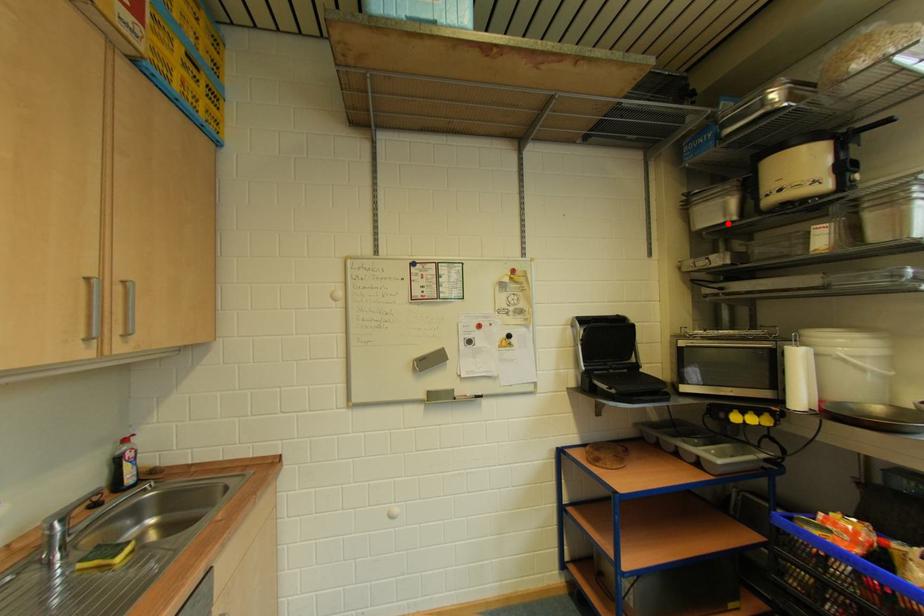
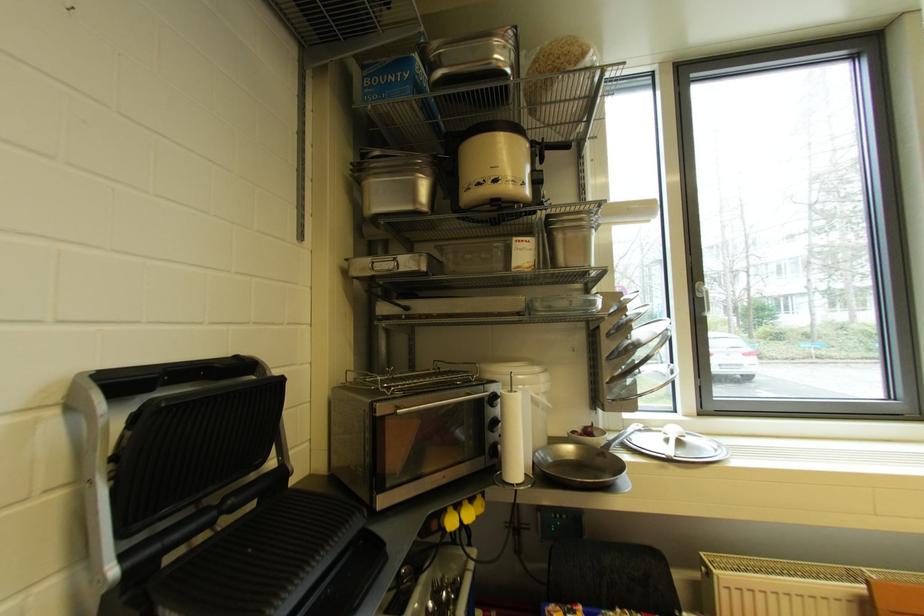
In the second image, find the point that corresponds to the highlighted location in the first image.

(418, 211)